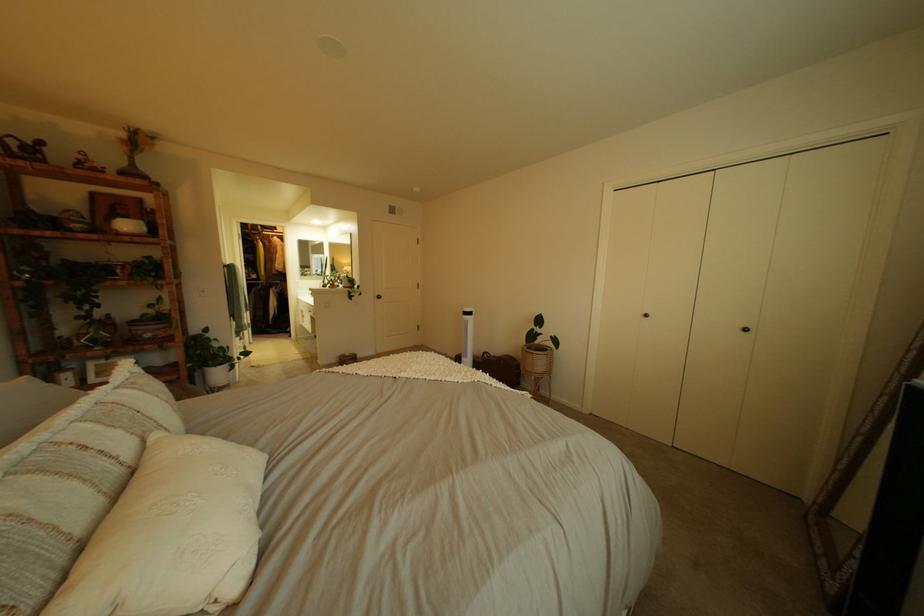
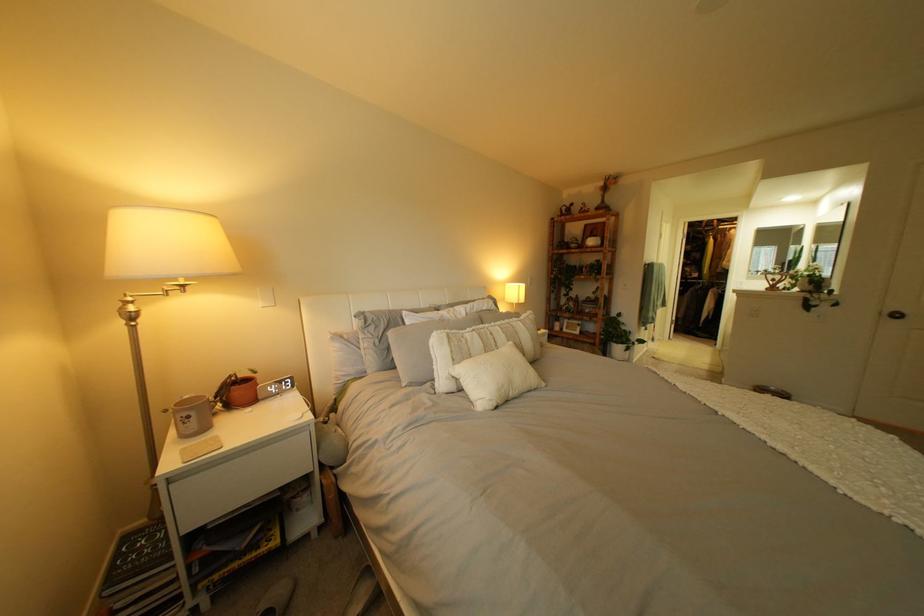
Find the pixel in the second image that matches pixel 134 434 in the first image.

(518, 337)